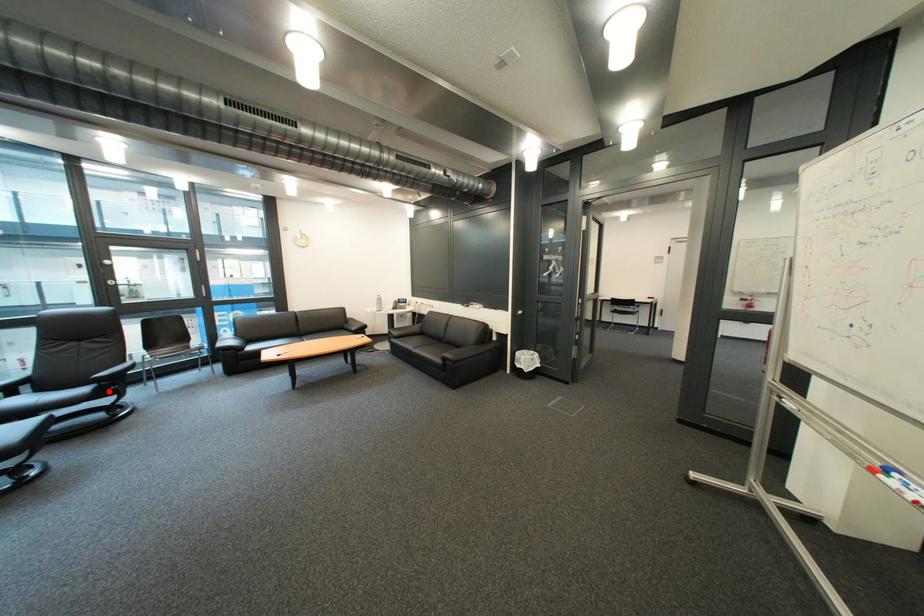
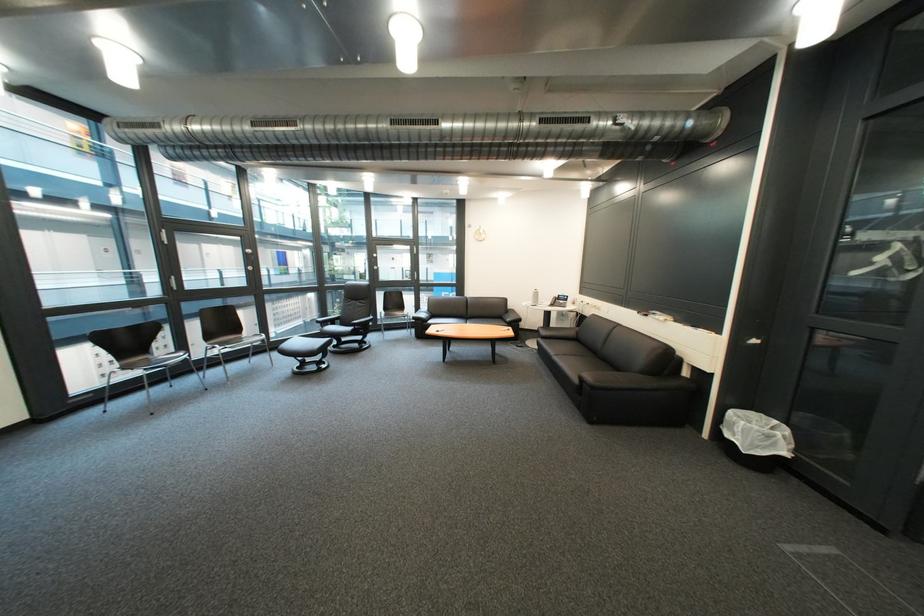
Question: I am providing you with two images of the same scene from different viewpoints. In image1, a red point is highlighted. Considering the same 3D point in image2, which of the following is correct?

Choices:
 (A) It is closer
 (B) It is farther

Answer: (A)